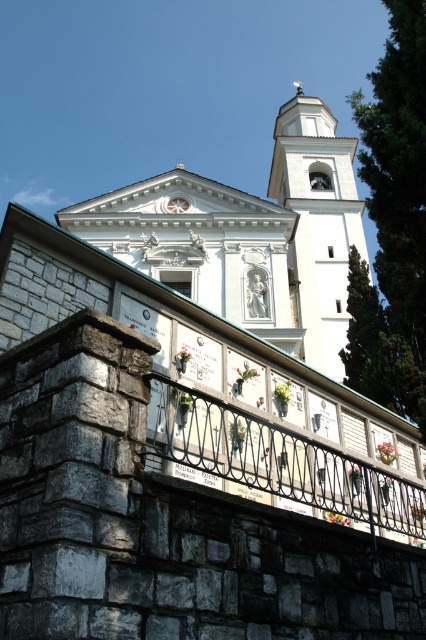
Question: Is black wrought iron railing at center bigger than white stone bell tower at upper center?

Choices:
 (A) yes
 (B) no

Answer: (B)

Question: Which object is farther from the camera taking this photo?

Choices:
 (A) white stone bell tower at upper center
 (B) black wrought iron railing at center

Answer: (A)

Question: Is black wrought iron railing at center positioned in front of white stone bell tower at upper center?

Choices:
 (A) no
 (B) yes

Answer: (B)

Question: Among these objects, which one is nearest to the camera?

Choices:
 (A) white stone bell tower at upper center
 (B) black wrought iron railing at center

Answer: (B)

Question: Where is black wrought iron railing at center located in relation to white stone bell tower at upper center in the image?

Choices:
 (A) right
 (B) left

Answer: (B)

Question: Which point is farther from the camera taking this photo?

Choices:
 (A) (210, 401)
 (B) (314, 211)

Answer: (B)